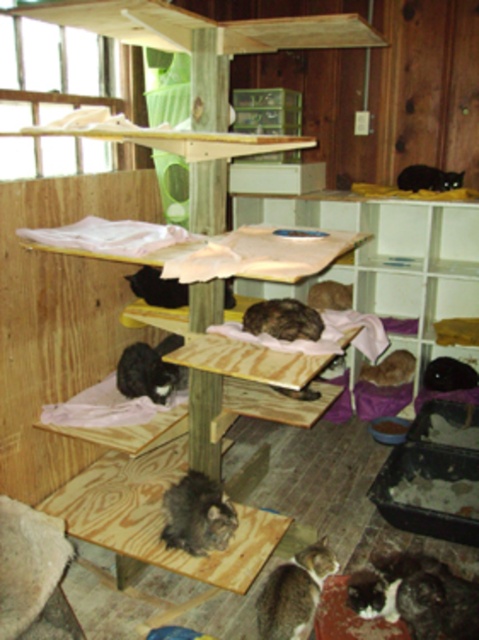
Is fluffy black-and-white cat at lower right thinner than gray fluffy cat at center?

Incorrect, fluffy black-and-white cat at lower right's width is not less than gray fluffy cat at center's.

Is fluffy black-and-white cat at lower right wider than gray fluffy cat at center?

Yes, fluffy black-and-white cat at lower right is wider than gray fluffy cat at center.

Image resolution: width=479 pixels, height=640 pixels. Identify the location of fluffy black-and-white cat at lower right. (417, 595).

Is wooden platform at center to the left of black fur cat at center from the viewer's perspective?

In fact, wooden platform at center is to the right of black fur cat at center.

Is wooden platform at center wider than black fur cat at center?

Yes.

Between point (139, 506) and point (157, 301), which one is positioned in front?

Point (139, 506) is in front.

Locate an element on the screen. Image resolution: width=479 pixels, height=640 pixels. wooden platform at center is located at coordinates (158, 516).

Can you confirm if wooden platform at center is bigger than fluffy gray cat at lower left?

Indeed, wooden platform at center has a larger size compared to fluffy gray cat at lower left.

Does wooden platform at center have a lesser height compared to fluffy gray cat at lower left?

In fact, wooden platform at center may be taller than fluffy gray cat at lower left.

Locate an element on the screen. wooden platform at center is located at coordinates (158, 516).